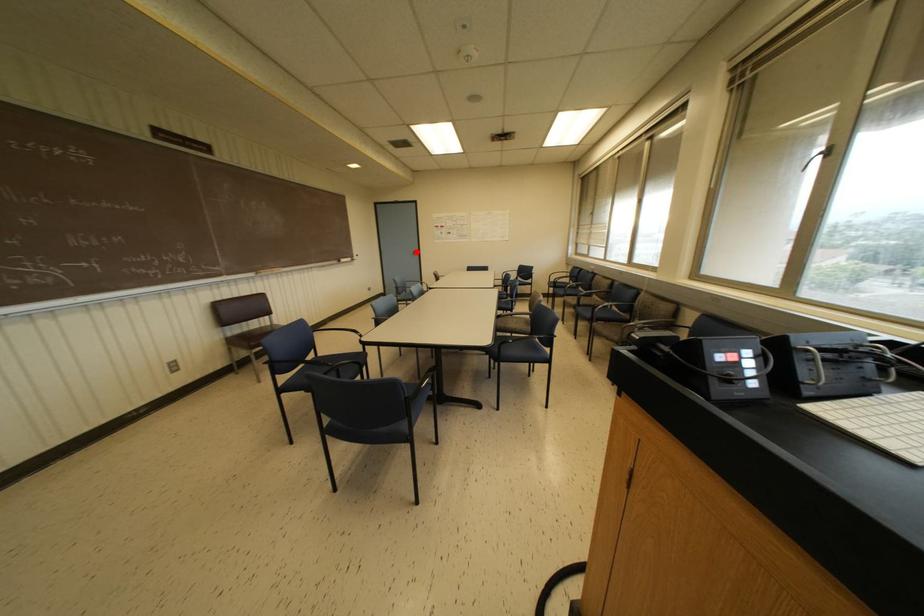
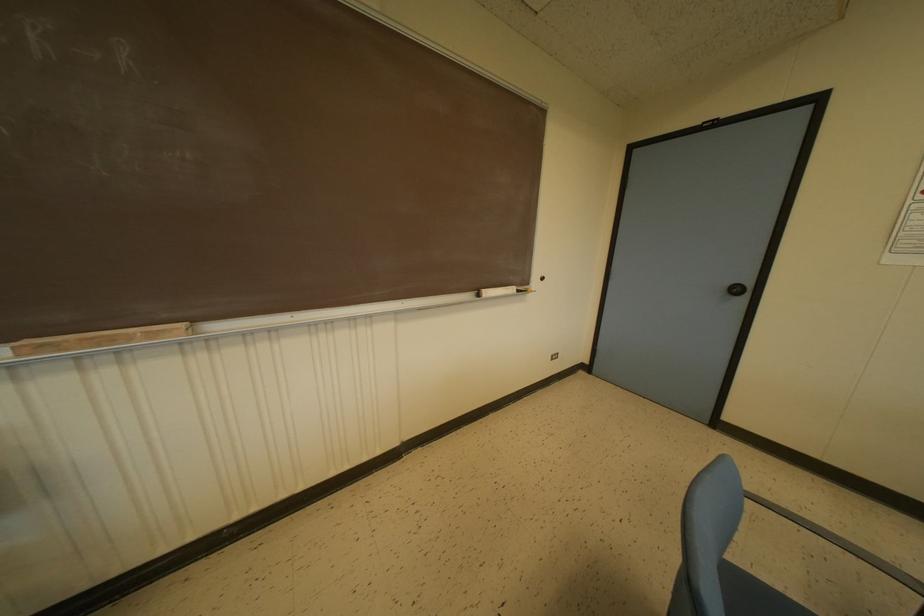
Question: A red point is marked in image1. In image2, is the corresponding 3D point closer to the camera or farther? Reply with the corresponding letter.

Choices:
 (A) The corresponding 3D point is closer.
 (B) The corresponding 3D point is farther.

Answer: (B)